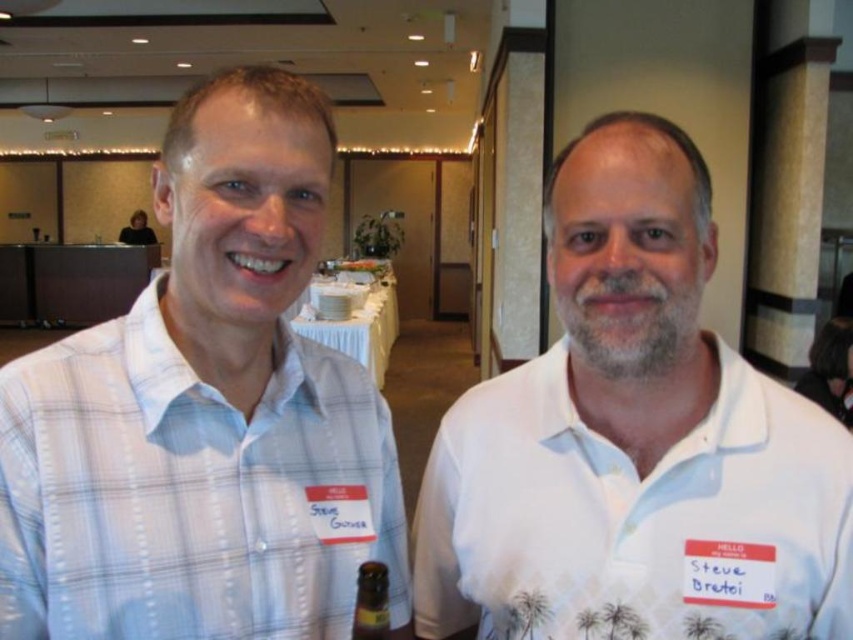
You are standing in the room and want to find the light blue plaid shirt at left. Based on its coordinates, where should you look?

The light blue plaid shirt at left is located at coordinates point 0.647 on the x axis and 0.242 on the y axis.